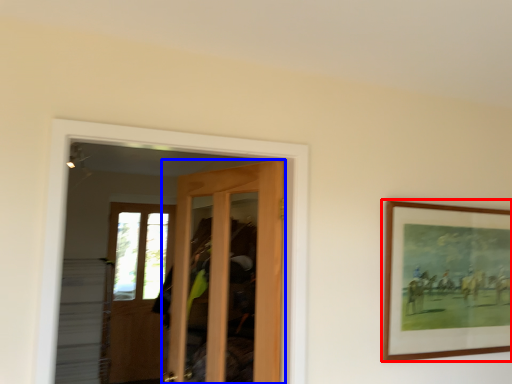
Question: Which object is further to the camera taking this photo, picture frame (highlighted by a red box) or door (highlighted by a blue box)?

Choices:
 (A) picture frame
 (B) door

Answer: (A)